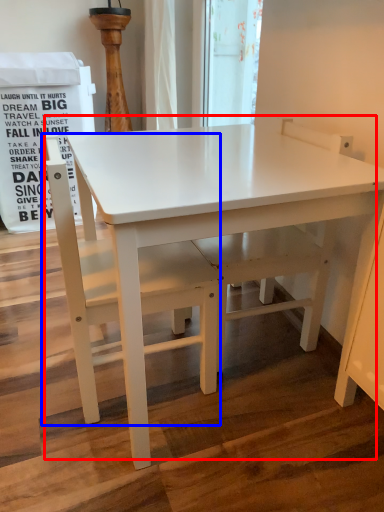
Question: Among these objects, which one is nearest to the camera, table (highlighted by a red box) or chair (highlighted by a blue box)?

Choices:
 (A) table
 (B) chair

Answer: (A)